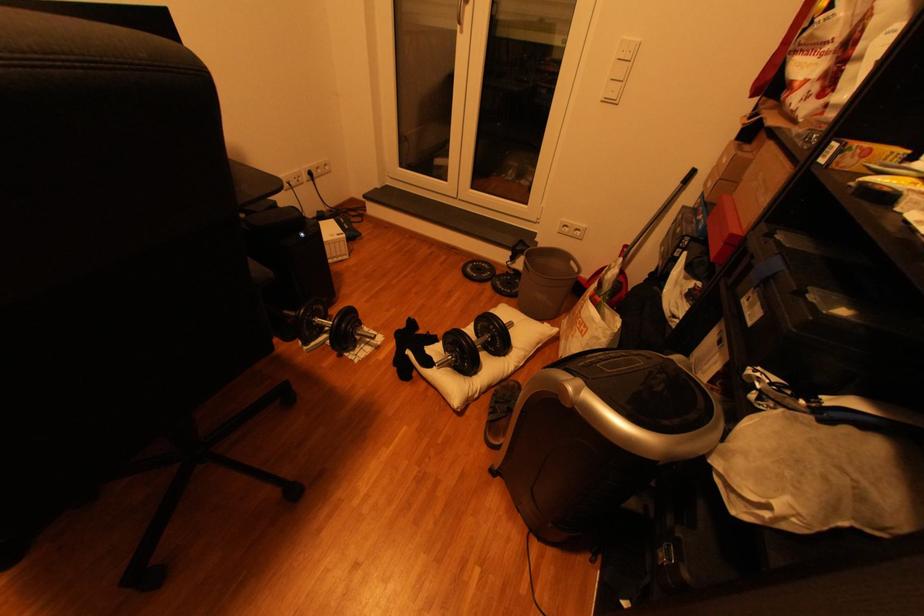
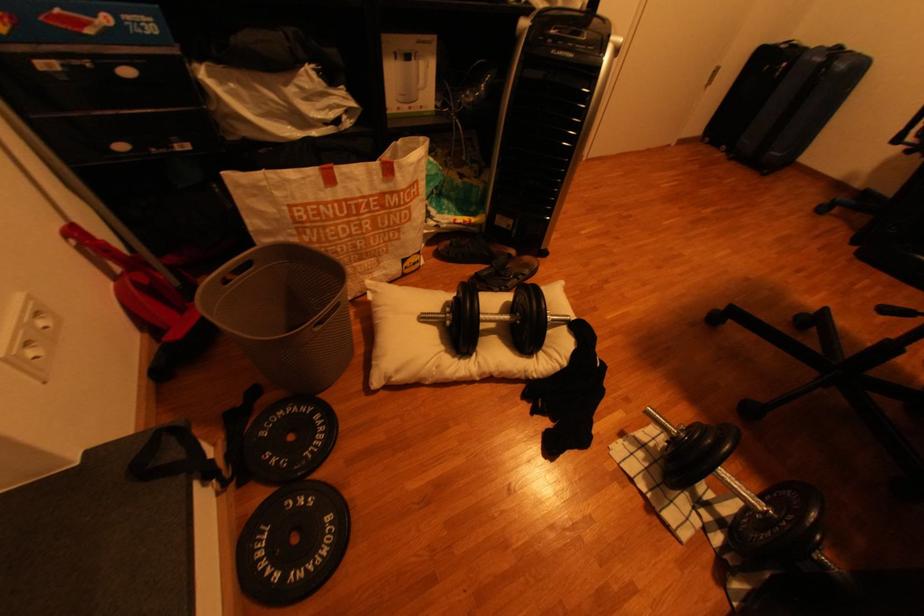
The point at (371,346) is marked in the first image. Where is the corresponding point in the second image?

(665, 446)